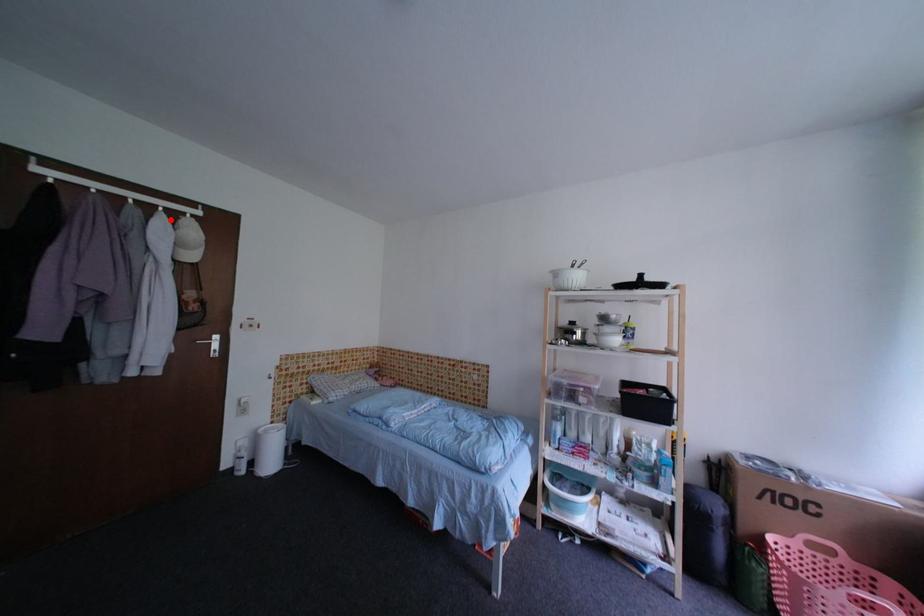
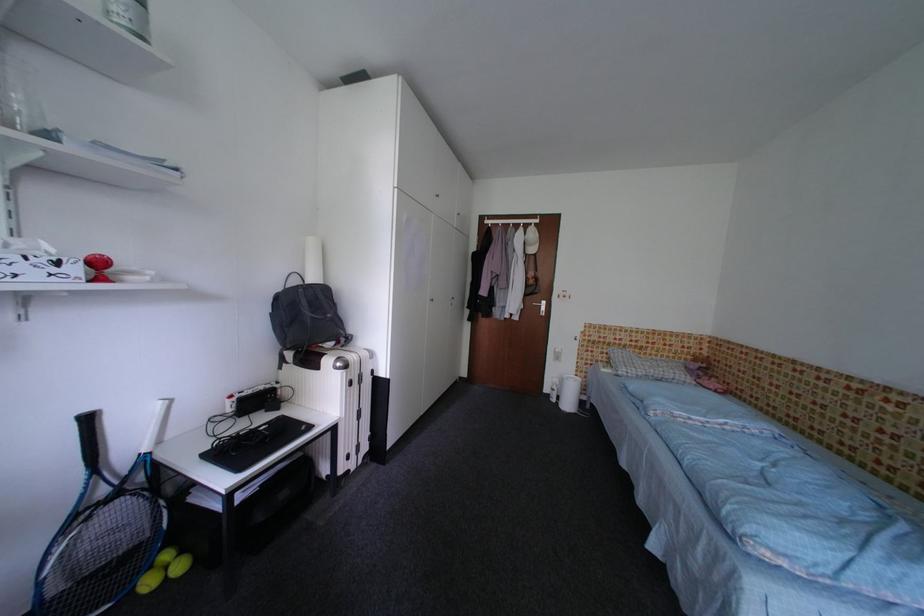
Question: I am providing you with two images of the same scene from different viewpoints. A red point is shown in image1. For the corresponding object point in image2, is it positioned nearer or farther from the camera?

Choices:
 (A) Nearer
 (B) Farther

Answer: (A)